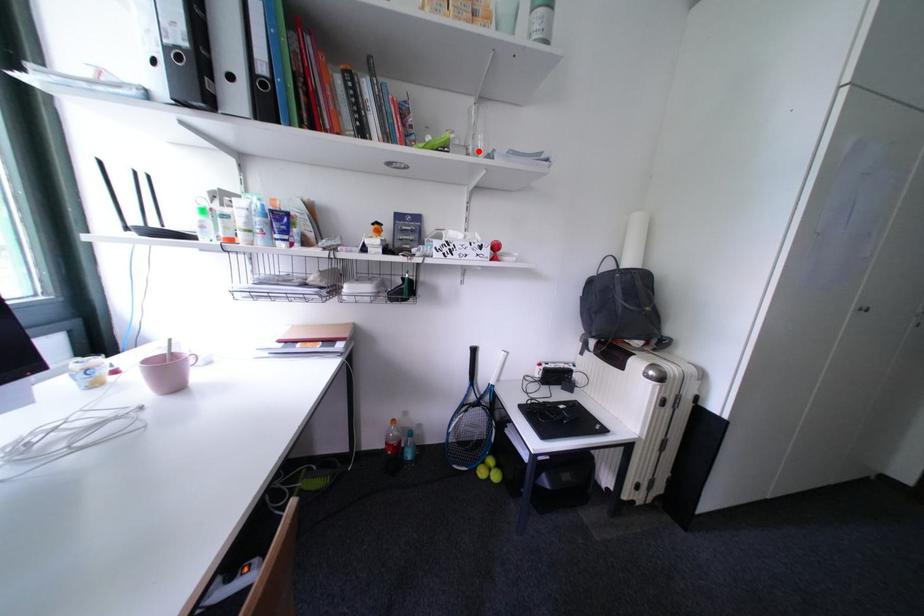
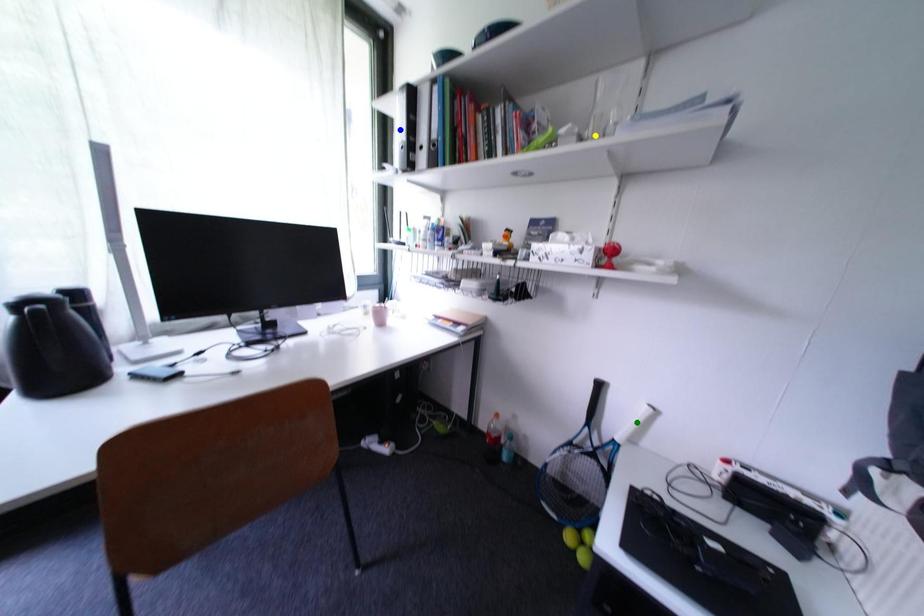
Question: I am providing you with two images of the same scene from different viewpoints. A red point is marked on the first image. You are given multiple points on the second image. Which spot in image 2 lines up with the point in image 1?

Choices:
 (A) yellow point
 (B) blue point
 (C) green point

Answer: (A)